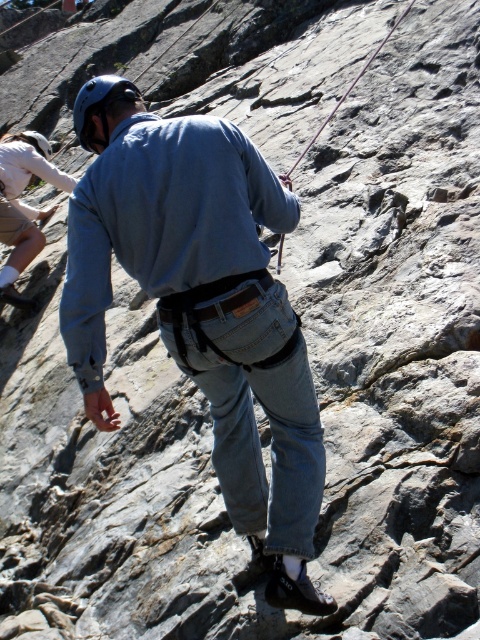
You are a photographer standing in front of the rock climbing scene. You want to capture a photo where the denim jeans at center and the white cotton shirt at upper left are both visible. Which object will appear larger in the photo?

The denim jeans at center will appear larger in the photo because it is closer to the viewer than the white cotton shirt at upper left.

You are a photographer trying to capture the climber from your current position. You notice two points on the rock face labeled as point (316, 513) and point (36, 160). Which point appears closer to you in the image?

Point (316, 513) is closer to the camera than point (36, 160), so it appears closer in the image.

You are a climber trying to reach the top of the rock. You see two handholds marked as point (263, 193) and point (140, 92). Which handhold should you grab first to make progress upwards?

You should grab point (263, 193) first because it is closer to you than point (140, 92), allowing for better leverage and control while climbing.